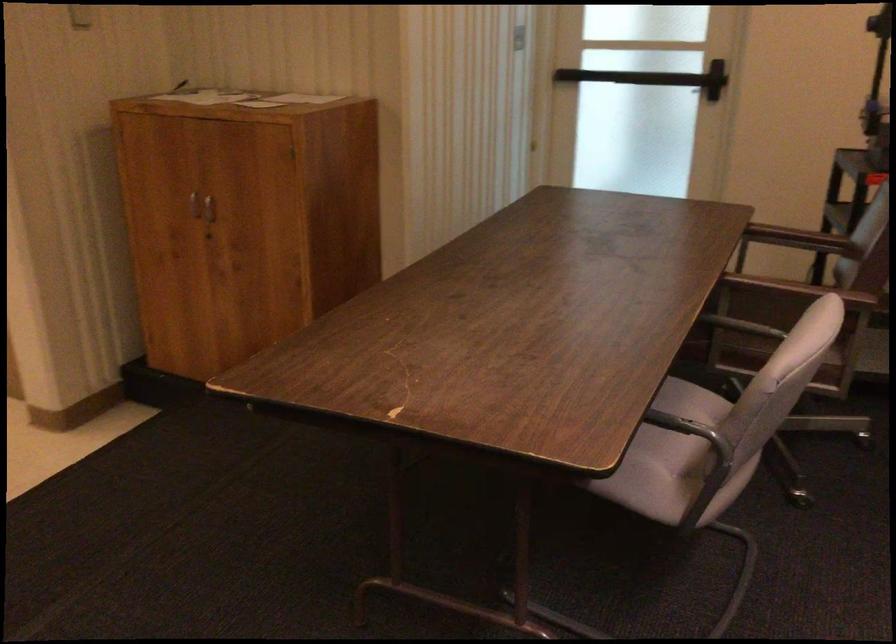
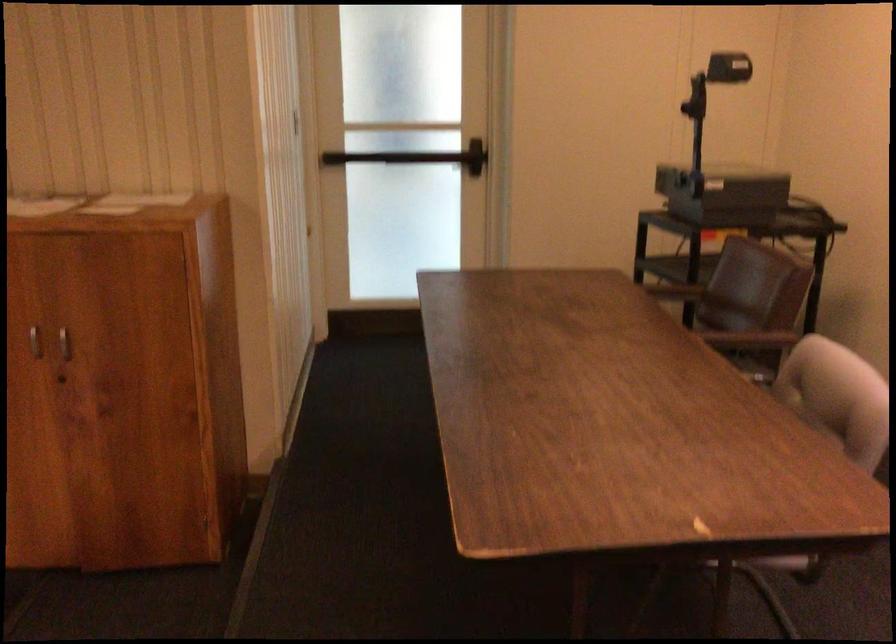
Looking at this image, the images are taken continuously from a first-person perspective. In which direction are you moving?

The cameraman moved toward left, forward.